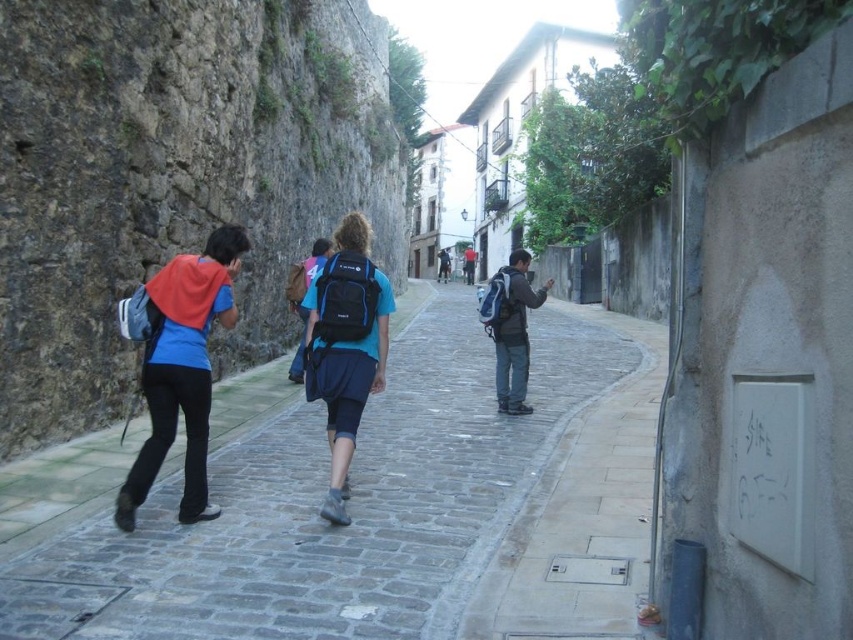
Is cobblestone pavement at center above matte blue backpack at center?

No.

From the picture: Who is shorter, cobblestone pavement at center or matte blue backpack at center?

matte blue backpack at center

Does point (381, 536) come behind point (511, 268)?

No, (381, 536) is in front of (511, 268).

Where is `cobblestone pavement at center`? This screenshot has width=853, height=640. cobblestone pavement at center is located at coordinates (379, 504).

Does blue matte backpack at center appear under matte blue backpack at center?

Correct, blue matte backpack at center is located below matte blue backpack at center.

This screenshot has height=640, width=853. What are the coordinates of `blue matte backpack at center` in the screenshot? It's located at (346, 348).

Measure the distance between point (376, 387) and camera.

Point (376, 387) is 34.75 feet from camera.

Identify the location of blue matte backpack at center. (346, 348).

Which is in front, point (616, 529) or point (161, 317)?

Point (161, 317)

Does metallic gray manhole cover at center-right have a lesser width compared to matte blue backpack at left?

No, metallic gray manhole cover at center-right is not thinner than matte blue backpack at left.

Is point (640, 483) positioned before point (218, 320)?

No.

Find the location of a particular element. The image size is (853, 640). metallic gray manhole cover at center-right is located at coordinates (579, 512).